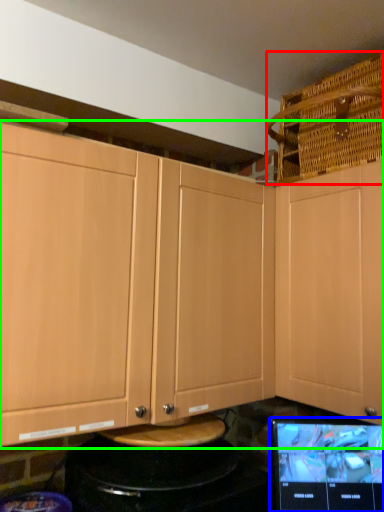
Question: Which object is positioned closest to basket (highlighted by a red box)? Select from computer monitor (highlighted by a blue box) and cabinetry (highlighted by a green box).

Choices:
 (A) computer monitor
 (B) cabinetry

Answer: (B)